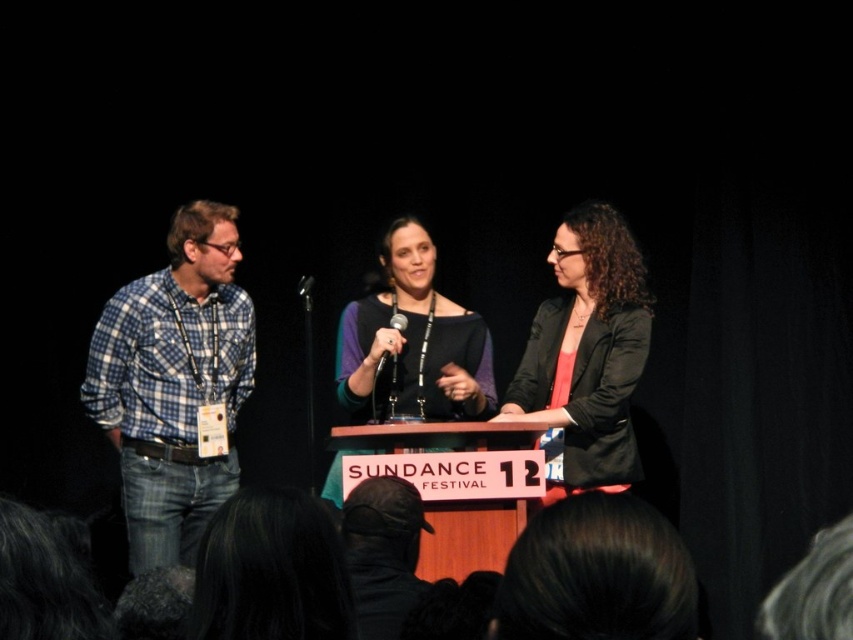
Which of these two, black plastic microphone at center or metallic silver microphone at center, stands taller?

black plastic microphone at center

Can you confirm if black plastic microphone at center is positioned to the right of metallic silver microphone at center?

Correct, you'll find black plastic microphone at center to the right of metallic silver microphone at center.

Image resolution: width=853 pixels, height=640 pixels. I want to click on black plastic microphone at center, so click(x=397, y=321).

Is blue plaid shirt at left positioned before metallic silver microphone at center?

Yes, it is.

Is blue plaid shirt at left taller than metallic silver microphone at center?

Yes, blue plaid shirt at left is taller than metallic silver microphone at center.

Image resolution: width=853 pixels, height=640 pixels. I want to click on blue plaid shirt at left, so click(x=173, y=384).

In the scene shown: Can you confirm if blue plaid shirt at left is positioned to the left of matte black sweater at center?

Indeed, blue plaid shirt at left is positioned on the left side of matte black sweater at center.

Does blue plaid shirt at left have a greater width compared to matte black sweater at center?

No, blue plaid shirt at left is not wider than matte black sweater at center.

What are the coordinates of `blue plaid shirt at left` in the screenshot? It's located at pyautogui.click(x=173, y=384).

Where is `blue plaid shirt at left`? Image resolution: width=853 pixels, height=640 pixels. blue plaid shirt at left is located at coordinates (173, 384).